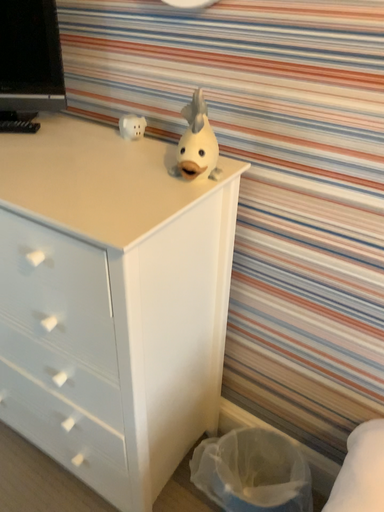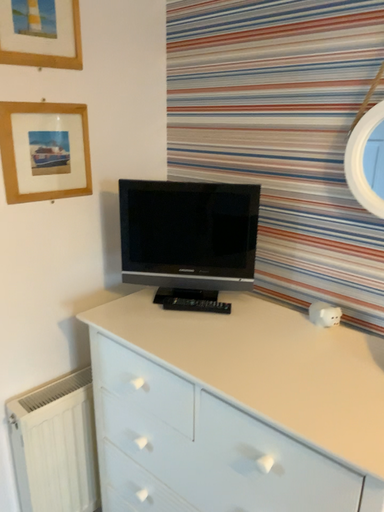
Question: Which way did the camera rotate in the video?

Choices:
 (A) rotated upward
 (B) rotated downward

Answer: (A)